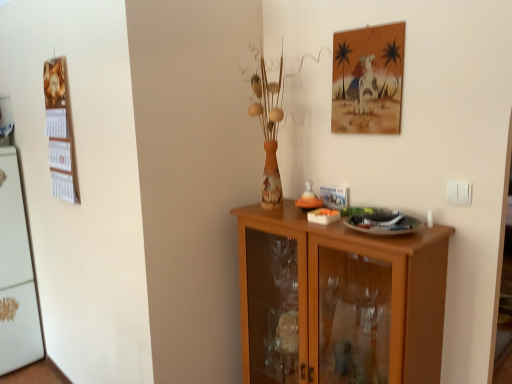
Question: Should I look upward or downward to see white plastic switch at right?

Choices:
 (A) up
 (B) down

Answer: (B)

Question: From the image's perspective, is wooden calendar at left on top of white plastic switch at right?

Choices:
 (A) no
 (B) yes

Answer: (B)

Question: Is wooden calendar at left at the left side of white plastic switch at right?

Choices:
 (A) no
 (B) yes

Answer: (B)

Question: Is wooden calendar at left oriented towards white plastic switch at right?

Choices:
 (A) no
 (B) yes

Answer: (A)

Question: Is wooden calendar at left far away from white plastic switch at right?

Choices:
 (A) yes
 (B) no

Answer: (A)

Question: Is wooden calendar at left closer to the viewer compared to white plastic switch at right?

Choices:
 (A) yes
 (B) no

Answer: (B)

Question: Can you confirm if wooden calendar at left is shorter than white plastic switch at right?

Choices:
 (A) yes
 (B) no

Answer: (B)

Question: From the image's perspective, would you say matte paper picture frame at upper right is positioned over white plastic switch at right?

Choices:
 (A) no
 (B) yes

Answer: (B)

Question: Considering the relative sizes of matte paper picture frame at upper right and white plastic switch at right in the image provided, is matte paper picture frame at upper right taller than white plastic switch at right?

Choices:
 (A) no
 (B) yes

Answer: (B)

Question: Considering the relative sizes of matte paper picture frame at upper right and white plastic switch at right in the image provided, is matte paper picture frame at upper right smaller than white plastic switch at right?

Choices:
 (A) yes
 (B) no

Answer: (B)

Question: Is matte paper picture frame at upper right not close to white plastic switch at right?

Choices:
 (A) no
 (B) yes

Answer: (A)

Question: Could you tell me if matte paper picture frame at upper right is turned towards white plastic switch at right?

Choices:
 (A) no
 (B) yes

Answer: (A)

Question: Is white plastic switch at right inside matte paper picture frame at upper right?

Choices:
 (A) yes
 (B) no

Answer: (B)

Question: Considering the relative positions of matte paper picture frame at upper right and wooden calendar at left in the image provided, is matte paper picture frame at upper right to the left of wooden calendar at left from the viewer's perspective?

Choices:
 (A) no
 (B) yes

Answer: (A)